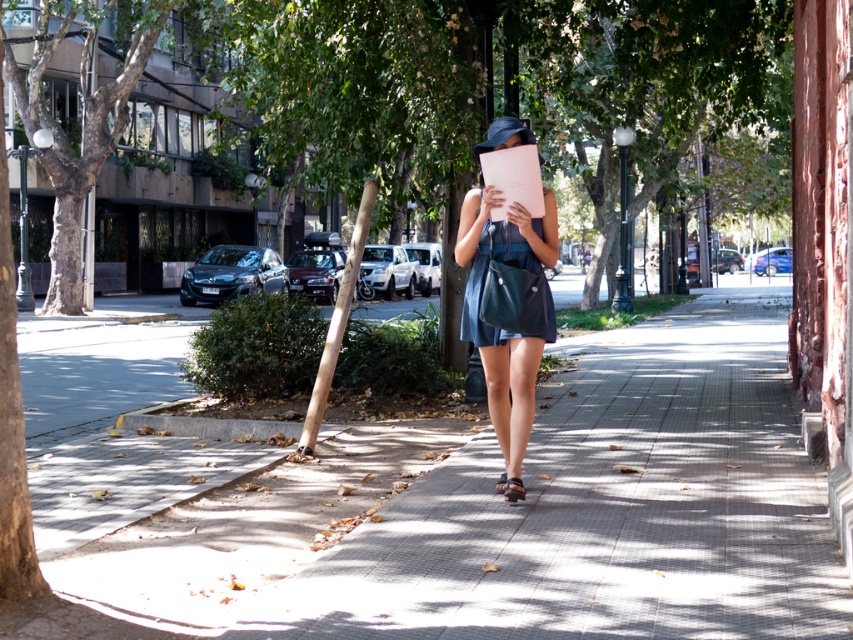
Between smooth concrete pavement at center and matte blue dress at center, which one appears on the right side from the viewer's perspective?

smooth concrete pavement at center

Which is behind, point (281, 616) or point (550, 243)?

Point (550, 243)

Image resolution: width=853 pixels, height=640 pixels. I want to click on smooth concrete pavement at center, so click(x=523, y=515).

Is brown leather sandal at center positioned before brown leather sandal at lower center?

Yes, brown leather sandal at center is in front of brown leather sandal at lower center.

Can you confirm if brown leather sandal at center is positioned to the left of brown leather sandal at lower center?

In fact, brown leather sandal at center is to the right of brown leather sandal at lower center.

Does point (518, 481) come in front of point (496, 481)?

Yes, point (518, 481) is in front of point (496, 481).

Locate an element on the screen. brown leather sandal at center is located at coordinates (514, 490).

This screenshot has width=853, height=640. In order to click on matte blue dress at center in this screenshot , I will do click(511, 394).

Between matte blue dress at center and denim dress at center, which one appears on the right side from the viewer's perspective?

denim dress at center

Identify the location of matte blue dress at center. (511, 394).